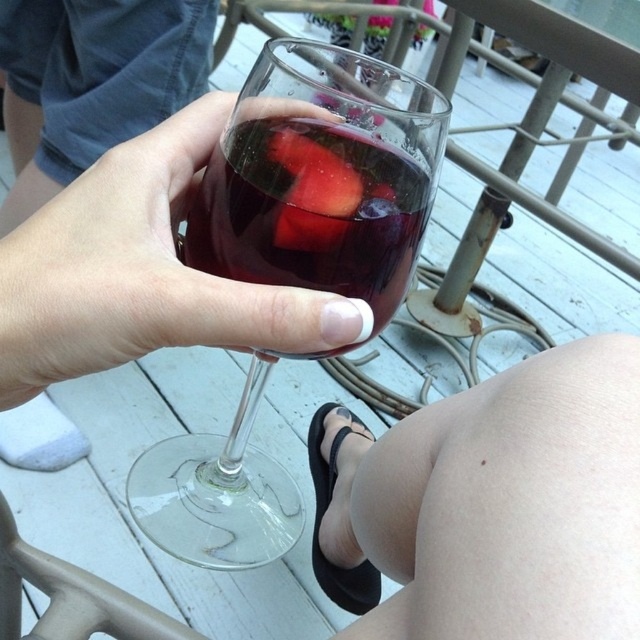
Question: Observing the image, what is the correct spatial positioning of smooth skin at lower right in reference to watermelon flesh at center?

Choices:
 (A) left
 (B) right

Answer: (B)

Question: Which point appears farthest from the camera in this image?

Choices:
 (A) (8, 317)
 (B) (403, 278)
 (C) (392, 618)

Answer: (B)

Question: Which point is closer to the camera?

Choices:
 (A) smooth skin at lower right
 (B) clear glass wine glass at center
 (C) matte glass at center

Answer: (A)

Question: Based on their relative distances, which object is farther from the watermelon flesh at center?

Choices:
 (A) transparent glass at center
 (B) translucent glass wine at center
 (C) matte glass at center

Answer: (A)

Question: Is translucent glass wine at center above clear glass wine glass at center?

Choices:
 (A) yes
 (B) no

Answer: (B)

Question: Is smooth skin at lower right bigger than watermelon flesh at center?

Choices:
 (A) no
 (B) yes

Answer: (B)